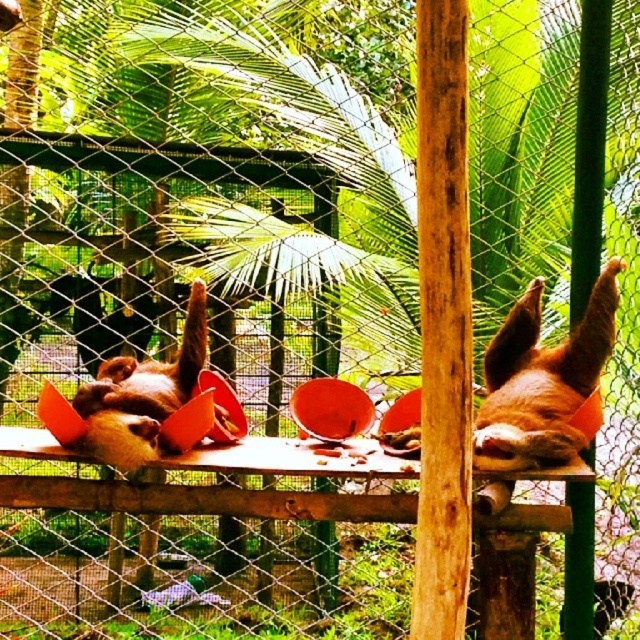
You are a zookeeper who needs to place a feeding tray on the platform. The tray requires a spot where both brown furry sloth at right and brown furry sloth at center can reach it comfortably. Considering their sizes, which sloth might need the tray placed closer to them?

The brown furry sloth at right is taller than the brown furry sloth at center, so the feeding tray should be placed closer to the shorter brown furry sloth at center to ensure both can reach it comfortably.